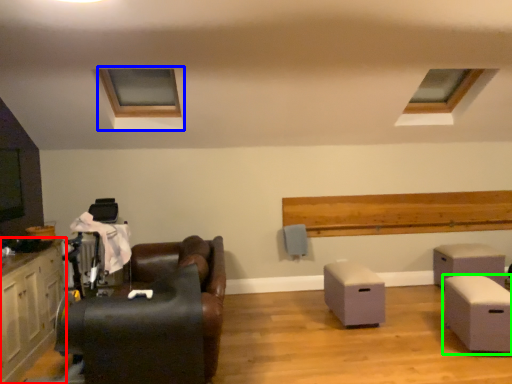
Question: Which is farther away from cabinetry (highlighted by a red box)? window frame (highlighted by a blue box) or table (highlighted by a green box)?

Choices:
 (A) window frame
 (B) table

Answer: (B)